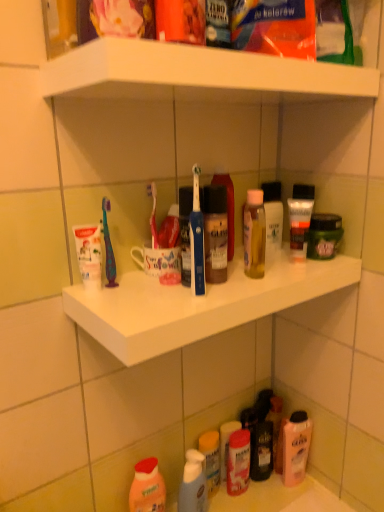
Question: From the image's perspective, is white plastic shelf at center above or below translucent plastic bottles at lower center?

Choices:
 (A) above
 (B) below

Answer: (A)

Question: Considering the positions of white plastic shelf at center and translucent plastic bottles at lower center in the image, is white plastic shelf at center taller or shorter than translucent plastic bottles at lower center?

Choices:
 (A) short
 (B) tall

Answer: (B)

Question: Based on their relative distances, which object is nearer to the translucent plastic spray bottle at lower center, the first toiletry in the left-to-right sequence?

Choices:
 (A) matte plastic container at lower center, which ranks as the third toiletry in top-to-bottom order
 (B) translucent plastic tube at upper center, the third toiletry from the left
 (C) translucent pink bottle at lower right, arranged as the first cleaning product when viewed from the back
 (D) white plastic shelf at center
 (E) white glossy shelf at upper center

Answer: (A)

Question: Considering the real-world distances, which object is farthest from the white glossy shelf at upper center?

Choices:
 (A) matte white tube at upper right, arranged as the third toiletry when ordered from the bottom
 (B) translucent plastic tube at upper center, positioned as the first toiletry in top-to-bottom order
 (C) white matte toothpaste at left
 (D) translucent plastic bottles at lower center
 (E) matte plastic container at lower center, arranged as the 3th toiletry when viewed from the right

Answer: (D)